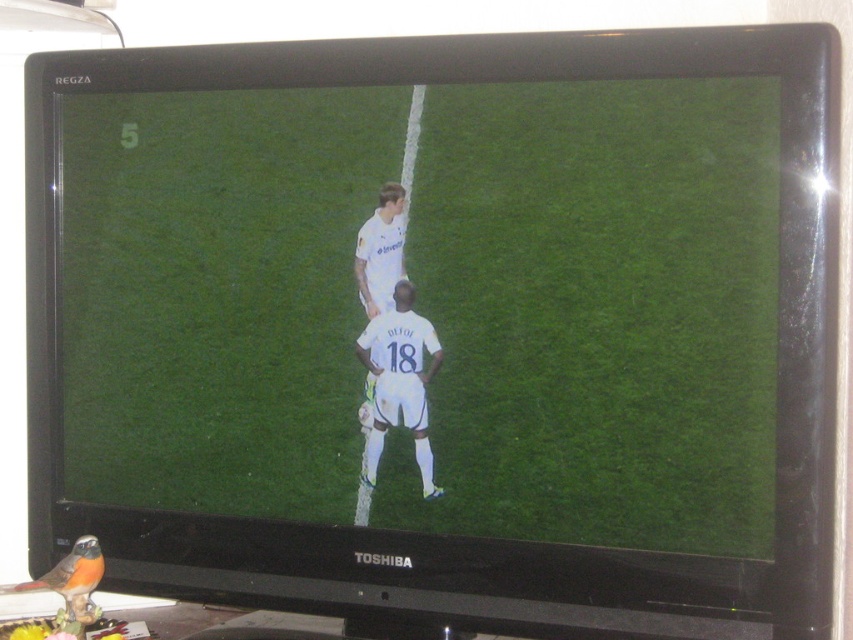
You are a soccer coach analyzing a training video on a TOSHIBA REGZA TV. You notice two white soccer players at the center of the screen. The TV screen measures 55 inches diagonally. Can you determine if the distance between the white matte soccer players at center and the white smooth soccer player at center on the screen is more than 15 centimeters?

The distance between the white matte soccer players at center and the white smooth soccer player at center is 14.69 centimeters, which is less than 15 centimeters. Therefore, the distance is not more than 15 centimeters.

You are a photographer standing in front of the TOSHIBA REGZA TV screen. You want to take a photo of the white matte soccer players at center displayed on the screen. If your camera can focus on objects up to 30 inches away, will it be able to capture a clear image of the players?

The white matte soccer players at center are 32.73 inches away from the camera, which is beyond the camera focus limit of 30 inches. Therefore, the camera will not be able to capture a clear image of the players.